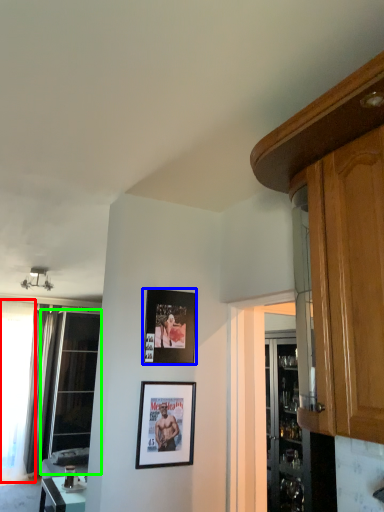
Question: Considering the real-world distances, which object is farthest from window (highlighted by a red box)? picture frame (highlighted by a blue box) or window (highlighted by a green box)?

Choices:
 (A) picture frame
 (B) window

Answer: (A)